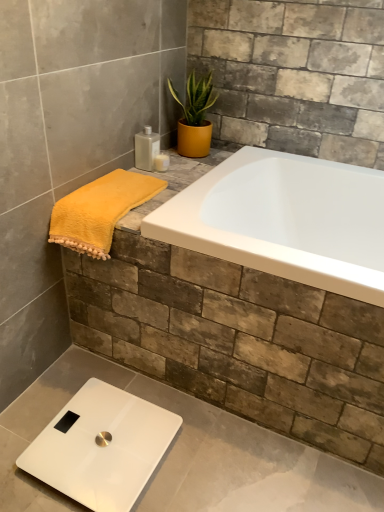
Question: In the image, is white glossy scale at lower left positioned in front of or behind matte yellow pot at upper center?

Choices:
 (A) behind
 (B) front

Answer: (B)

Question: From the image's perspective, relative to matte yellow pot at upper center, is white glossy scale at lower left above or below?

Choices:
 (A) below
 (B) above

Answer: (A)

Question: Which object is positioned farthest from the yellow fluffy towel at left?

Choices:
 (A) translucent plastic bottle at upper center, marked as the 2th toiletry in a right-to-left arrangement
 (B) translucent plastic soap dispenser at upper center, placed as the 1th toiletry when sorted from right to left
 (C) matte yellow pot at upper center
 (D) white glossy scale at lower left

Answer: (D)

Question: Which object is the closest to the white glossy scale at lower left?

Choices:
 (A) matte yellow pot at upper center
 (B) yellow fluffy towel at left
 (C) translucent plastic soap dispenser at upper center, which is the 2th toiletry in left-to-right order
 (D) translucent plastic bottle at upper center, acting as the 1th toiletry starting from the left

Answer: (B)